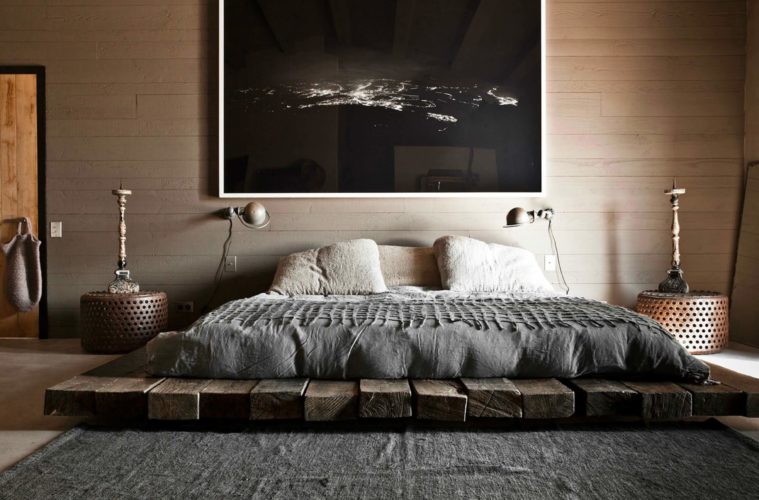
At what (x,y) coordinates should I click in order to perform the action: click on pillow. Please return your answer as a coordinate pair (x, y). This screenshot has height=500, width=759. Looking at the image, I should click on (471, 266).